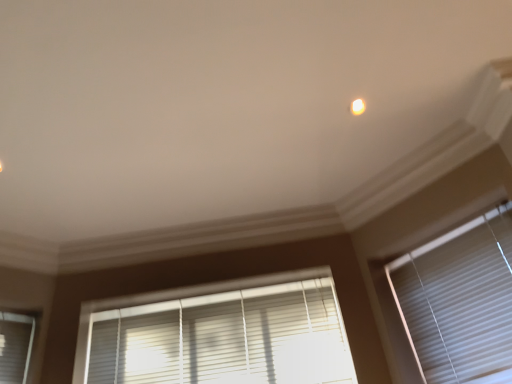
Question: From the image's perspective, is white glossy light at upper center on white plastic blinds at lower center, which appears as the second window blind when viewed from the right?

Choices:
 (A) yes
 (B) no

Answer: (A)

Question: Is white glossy light at upper center with white plastic blinds at lower center, which appears as the second window blind when viewed from the right?

Choices:
 (A) no
 (B) yes

Answer: (A)

Question: Does white glossy light at upper center have a larger size compared to white plastic blinds at lower center, the 1th window blind positioned from the left?

Choices:
 (A) no
 (B) yes

Answer: (A)

Question: From a real-world perspective, is white glossy light at upper center below white plastic blinds at lower center, which appears as the second window blind when viewed from the right?

Choices:
 (A) no
 (B) yes

Answer: (A)

Question: Can you confirm if white glossy light at upper center is shorter than white plastic blinds at lower center, which appears as the second window blind when viewed from the right?

Choices:
 (A) yes
 (B) no

Answer: (A)

Question: From a real-world perspective, is white glossy light at upper center located higher than white plastic blinds at lower center, the 1th window blind positioned from the left?

Choices:
 (A) no
 (B) yes

Answer: (B)

Question: Considering the relative sizes of white plastic blinds at lower center, which appears as the second window blind when viewed from the right, and white glossy light at upper center in the image provided, is white plastic blinds at lower center, which appears as the second window blind when viewed from the right, thinner than white glossy light at upper center?

Choices:
 (A) yes
 (B) no

Answer: (A)

Question: Considering the relative sizes of white plastic blinds at lower center, which appears as the second window blind when viewed from the right, and white glossy light at upper center in the image provided, is white plastic blinds at lower center, which appears as the second window blind when viewed from the right, wider than white glossy light at upper center?

Choices:
 (A) no
 (B) yes

Answer: (A)

Question: Is white plastic blinds at lower center, the 1th window blind positioned from the left, oriented towards white glossy light at upper center?

Choices:
 (A) yes
 (B) no

Answer: (B)

Question: From a real-world perspective, does white plastic blinds at lower center, which appears as the second window blind when viewed from the right, sit lower than white glossy light at upper center?

Choices:
 (A) no
 (B) yes

Answer: (B)

Question: From a real-world perspective, is white plastic blinds at lower center, the 1th window blind positioned from the left, physically above white glossy light at upper center?

Choices:
 (A) yes
 (B) no

Answer: (B)

Question: Is white plastic blinds at lower center, the 1th window blind positioned from the left, further to camera compared to white glossy light at upper center?

Choices:
 (A) no
 (B) yes

Answer: (B)

Question: Does white glossy light at upper center lie in front of white matte window blind at right, which appears as the 1th window blind when viewed from the right?

Choices:
 (A) no
 (B) yes

Answer: (A)